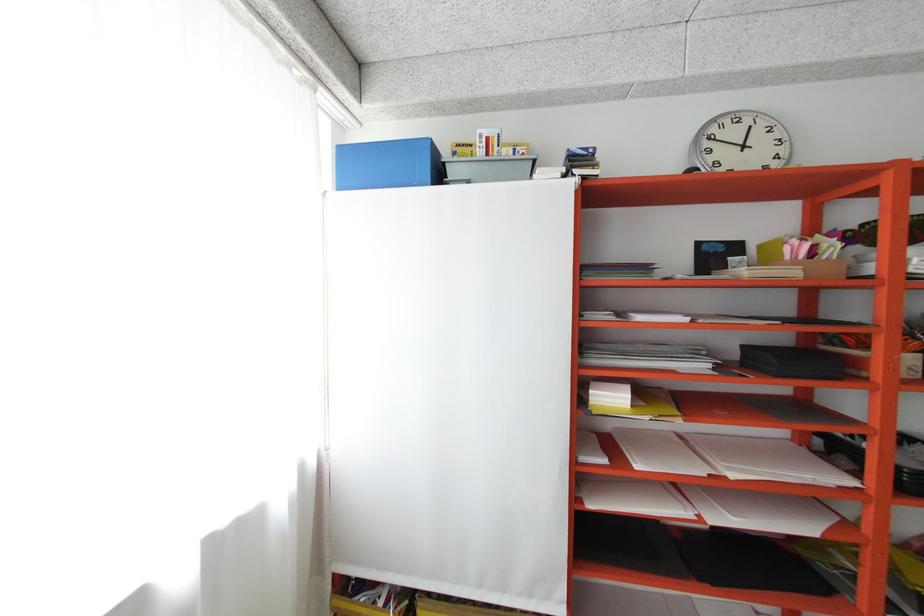
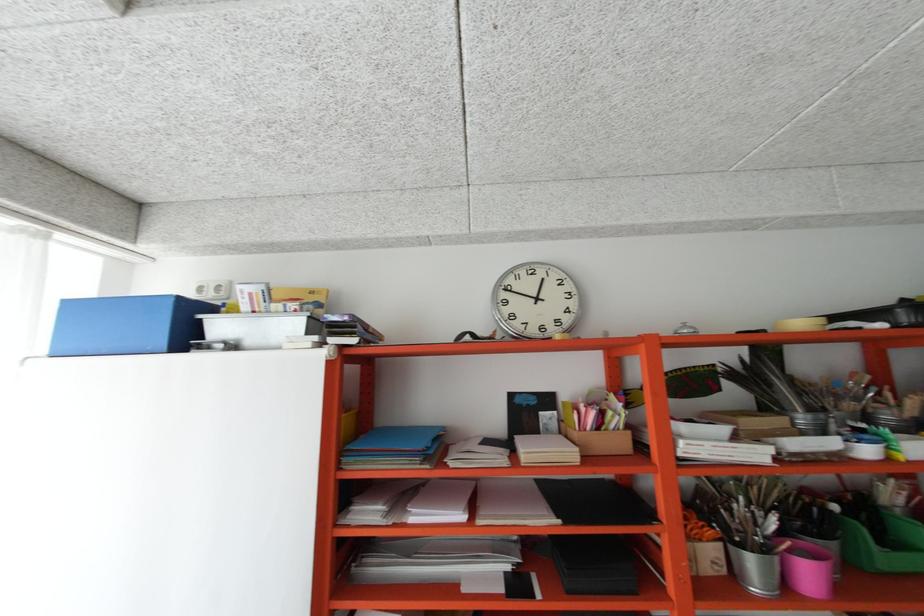
Question: In a continuous first-person perspective shot, in which direction is the camera moving?

Choices:
 (A) Left
 (B) Right
 (C) Forward
 (D) Backward

Answer: (B)